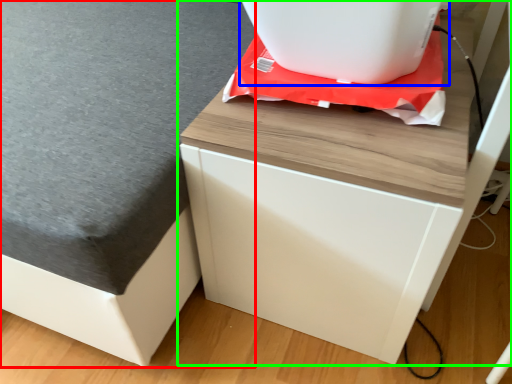
Question: Which object is the farthest from table top (highlighted by a red box)? Choose among these: appliance (highlighted by a blue box) or furniture (highlighted by a green box).

Choices:
 (A) appliance
 (B) furniture

Answer: (A)